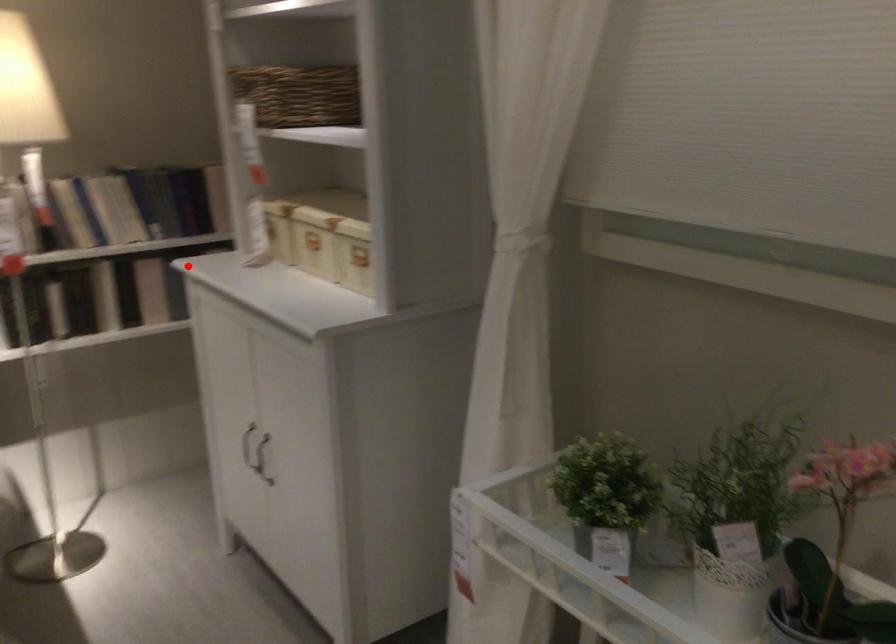
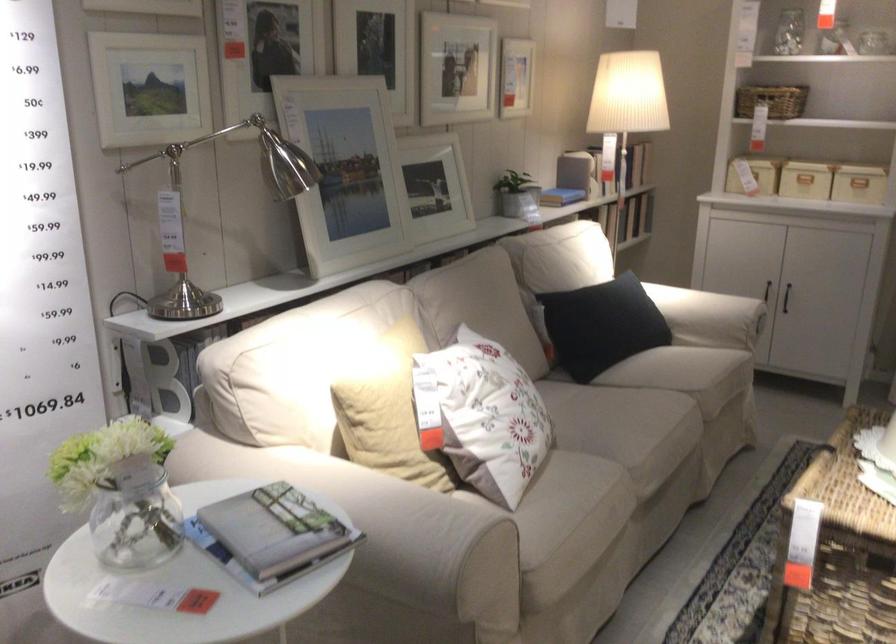
Locate, in the second image, the point that corresponds to the highlighted location in the first image.

(753, 175)